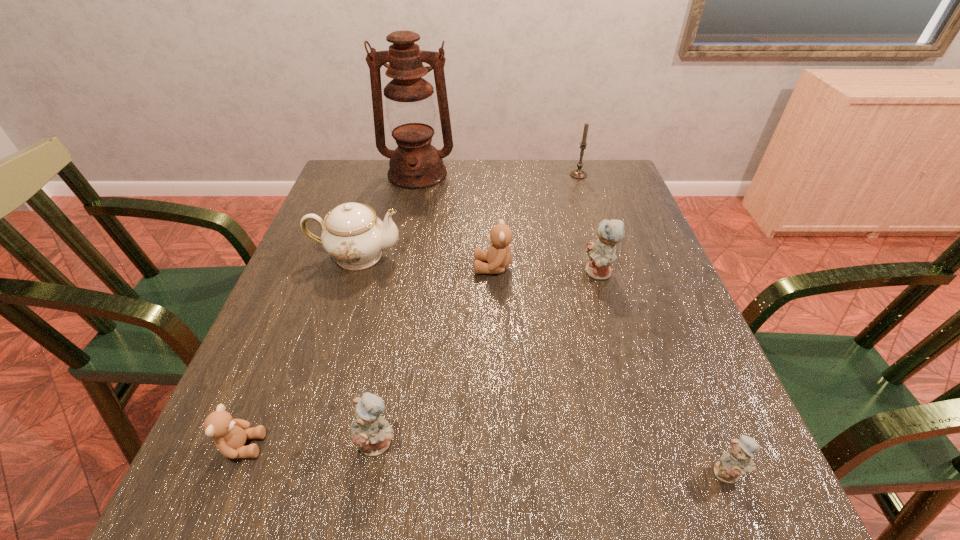
You are a GUI agent. You are given a task and a screenshot of the screen. Output one action in this format:
    pyautogui.click(x=<x>, y=<y>)
    Task: Click on the candle positioned at the right edge
    
    Given the screenshot: What is the action you would take?
    pyautogui.click(x=578, y=173)

Identify the location of object that is at the far left corner. This screenshot has width=960, height=540. (415, 164).

The image size is (960, 540). Identify the location of object that is at the far right corner. (578, 173).

Where is `object located at the near right corner`? object located at the near right corner is located at coordinates 737,461.

In the image, there is a desktop. Where is `vacant space at the far edge`? vacant space at the far edge is located at coordinates (567, 172).

Where is `free space at the near edge of the desktop`? The image size is (960, 540). free space at the near edge of the desktop is located at coordinates (541, 504).

Find the location of a particular element. The width and height of the screenshot is (960, 540). free space at the left edge of the desktop is located at coordinates (320, 233).

In the image, there is a desktop. Identify the location of vacant space at the right edge. [684, 465].

Locate an element on the screen. Image resolution: width=960 pixels, height=540 pixels. free space between the chinaware and the smallest blue teddy bear is located at coordinates (542, 364).

Identify the location of free space between the nearest blue teddy bear and the biggest blue teddy bear. The image size is (960, 540). tap(663, 373).